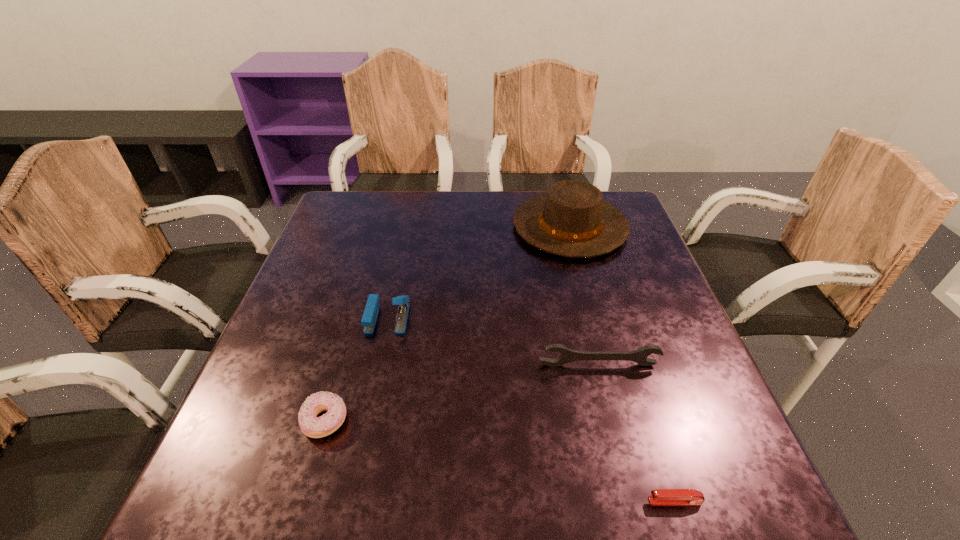
Image resolution: width=960 pixels, height=540 pixels. What are the coordinates of `the farthest object` in the screenshot? It's located at (572, 220).

Locate an element on the screen. The image size is (960, 540). cowboy hat is located at coordinates (572, 220).

Where is `the farther stapler`? This screenshot has width=960, height=540. the farther stapler is located at coordinates click(x=369, y=317).

This screenshot has height=540, width=960. Find the location of `the second tallest object`. the second tallest object is located at coordinates (369, 317).

The height and width of the screenshot is (540, 960). Identify the location of the third farthest object. (567, 355).

Find the location of a particular element. wrench is located at coordinates (567, 355).

The width and height of the screenshot is (960, 540). Find the location of `the fourth farthest object`. the fourth farthest object is located at coordinates (312, 426).

Locate an element on the screen. The height and width of the screenshot is (540, 960). the fourth tallest object is located at coordinates (312, 426).

Image resolution: width=960 pixels, height=540 pixels. Identify the location of the right stapler. (659, 496).

Where is `the shorter stapler`? The image size is (960, 540). the shorter stapler is located at coordinates (659, 496).